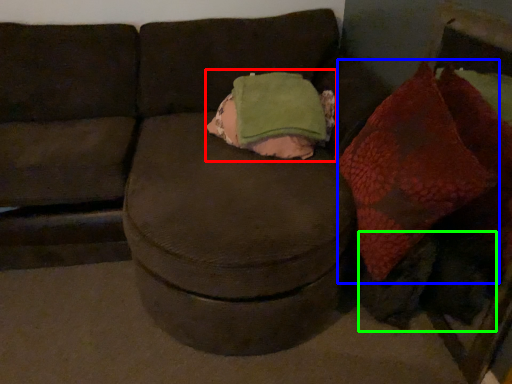
Question: Estimate the real-world distances between objects in this image. Which object is farther from throw pillow (highlighted by a red box), bean bag chair (highlighted by a blue box) or animal (highlighted by a green box)?

Choices:
 (A) bean bag chair
 (B) animal

Answer: (B)